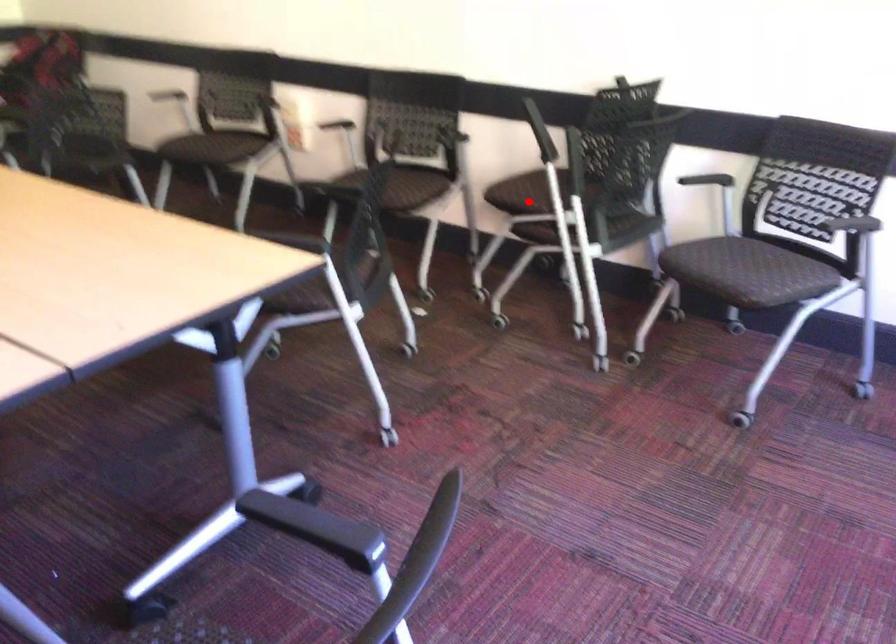
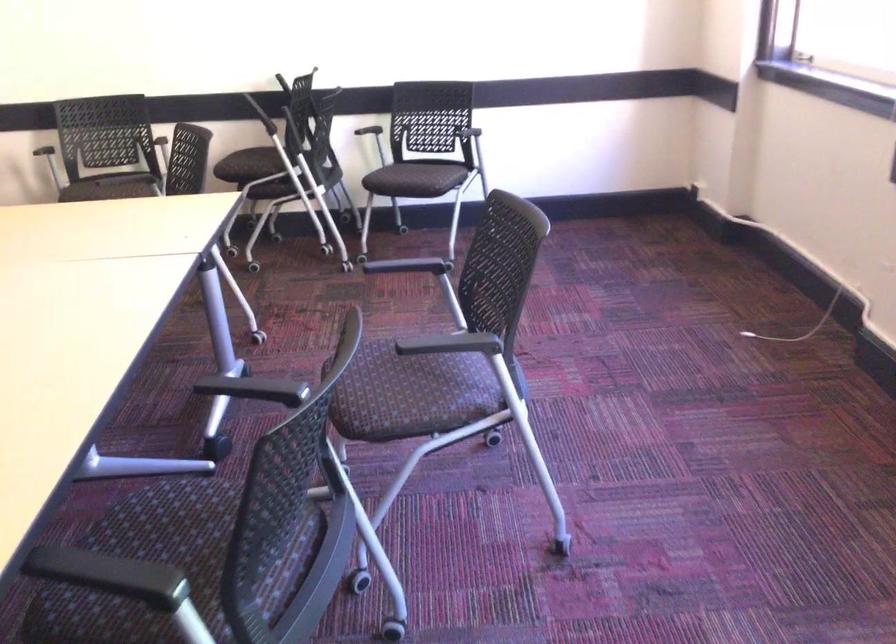
The point at the highlighted location is marked in the first image. Where is the corresponding point in the second image?

(252, 166)